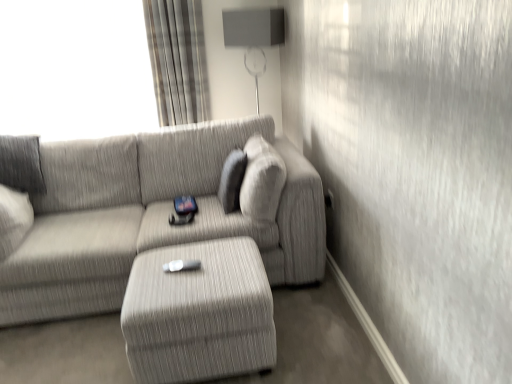
Question: Can you confirm if plaid fabric curtain at upper left is taller than matte gray lampshade at upper center?

Choices:
 (A) yes
 (B) no

Answer: (B)

Question: From the image's perspective, is plaid fabric curtain at upper left under matte gray lampshade at upper center?

Choices:
 (A) no
 (B) yes

Answer: (A)

Question: Is plaid fabric curtain at upper left smaller than matte gray lampshade at upper center?

Choices:
 (A) no
 (B) yes

Answer: (B)

Question: Is the position of plaid fabric curtain at upper left more distant than that of matte gray lampshade at upper center?

Choices:
 (A) yes
 (B) no

Answer: (A)

Question: Is plaid fabric curtain at upper left at the left side of matte gray lampshade at upper center?

Choices:
 (A) no
 (B) yes

Answer: (B)

Question: Considering the relative positions of textured gray couch at center and plaid fabric curtain at upper left in the image provided, is textured gray couch at center to the left or to the right of plaid fabric curtain at upper left?

Choices:
 (A) left
 (B) right

Answer: (A)

Question: Considering their positions, is textured gray couch at center located in front of or behind plaid fabric curtain at upper left?

Choices:
 (A) front
 (B) behind

Answer: (A)

Question: From the image's perspective, is textured gray couch at center positioned above or below plaid fabric curtain at upper left?

Choices:
 (A) below
 (B) above

Answer: (A)

Question: Which is correct: textured gray couch at center is inside plaid fabric curtain at upper left, or outside of it?

Choices:
 (A) outside
 (B) inside

Answer: (A)

Question: Considering their positions, is plaid fabric curtain at upper left located in front of or behind textured gray ottoman at center?

Choices:
 (A) front
 (B) behind

Answer: (B)

Question: Considering the positions of point (142, 1) and point (209, 334), is point (142, 1) closer or farther from the camera than point (209, 334)?

Choices:
 (A) farther
 (B) closer

Answer: (A)

Question: Based on their positions, is plaid fabric curtain at upper left located to the left or right of textured gray ottoman at center?

Choices:
 (A) left
 (B) right

Answer: (A)

Question: Is plaid fabric curtain at upper left situated inside textured gray ottoman at center or outside?

Choices:
 (A) outside
 (B) inside

Answer: (A)

Question: Looking at their shapes, would you say plaid fabric curtain at upper left is wider or thinner than textured gray couch at center?

Choices:
 (A) thin
 (B) wide

Answer: (A)

Question: In terms of size, does plaid fabric curtain at upper left appear bigger or smaller than textured gray couch at center?

Choices:
 (A) small
 (B) big

Answer: (A)